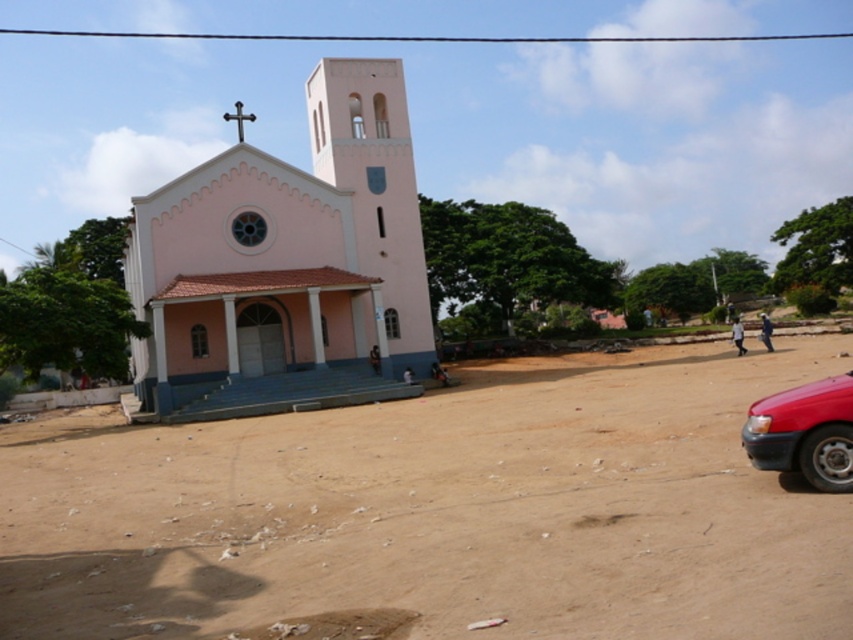
Is pink matte church at center thinner than shiny red car at lower right?

Incorrect, pink matte church at center's width is not less than shiny red car at lower right's.

Where is `pink matte church at center`? pink matte church at center is located at coordinates (287, 266).

Find the location of a particular element. Image resolution: width=853 pixels, height=640 pixels. pink matte church at center is located at coordinates (287, 266).

Which is more to the left, brown sandy dirt field at center or pink matte church at center?

From the viewer's perspective, pink matte church at center appears more on the left side.

Is brown sandy dirt field at center below pink matte church at center?

Yes.

Who is more distant from viewer, (819, 618) or (231, 321)?

Point (231, 321)

You are a GUI agent. You are given a task and a screenshot of the screen. Output one action in this format:
    pyautogui.click(x=<x>, y=<y>)
    Task: Click on the brown sandy dirt field at center
    The image size is (853, 640).
    Given the screenshot: What is the action you would take?
    pyautogui.click(x=438, y=512)

Between point (62, 509) and point (846, 381), which one is positioned behind?

The point (62, 509) is behind.

Is point (381, 605) closer to camera compared to point (808, 397)?

Yes.

Between point (410, 548) and point (792, 433), which one is positioned behind?

Positioned behind is point (792, 433).

At what (x,y) coordinates should I click in order to perform the action: click on brown sandy dirt field at center. Please return your answer as a coordinate pair (x, y). Looking at the image, I should click on (438, 512).